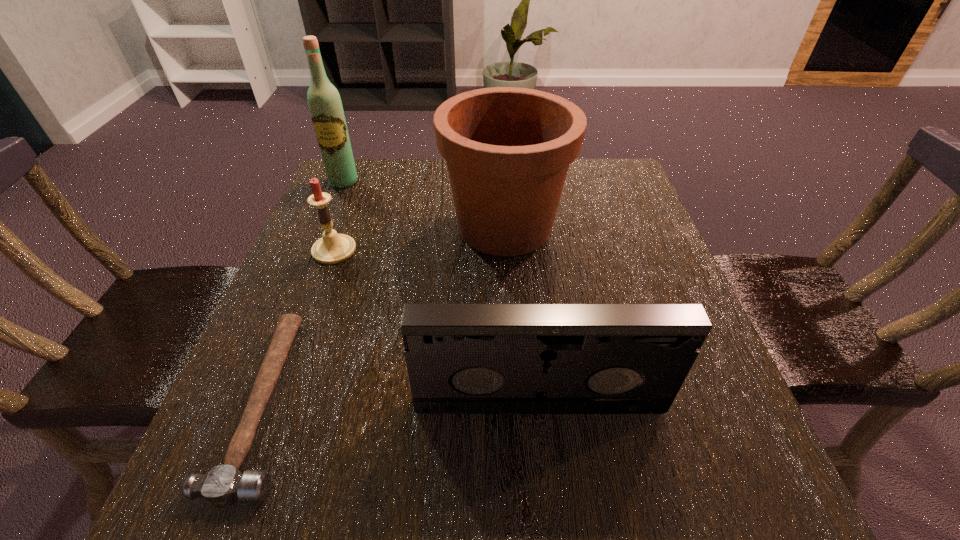
Identify the location of vacant region located on the striking face of the shortest object. (549, 402).

In order to click on wine bottle at the far edge in this screenshot , I will do `click(325, 105)`.

Find the location of a particular element. The width and height of the screenshot is (960, 540). flowerpot present at the far edge is located at coordinates (508, 150).

Find the location of a particular element. The height and width of the screenshot is (540, 960). object located in the near edge section of the desktop is located at coordinates (223, 485).

This screenshot has width=960, height=540. What are the coordinates of `wine bottle that is at the left edge` in the screenshot? It's located at tap(325, 105).

Find the location of `candle present at the left edge`. candle present at the left edge is located at coordinates (332, 248).

Identify the location of hammer located in the left edge section of the desktop. This screenshot has height=540, width=960. (223, 485).

This screenshot has height=540, width=960. Identify the location of object that is at the right edge. (461, 358).

At what (x,y) coordinates should I click in order to perform the action: click on object that is at the far left corner. Please return your answer as a coordinate pair (x, y). The image size is (960, 540). Looking at the image, I should click on (325, 105).

Locate an element on the screen. The image size is (960, 540). object present at the near left corner is located at coordinates (223, 485).